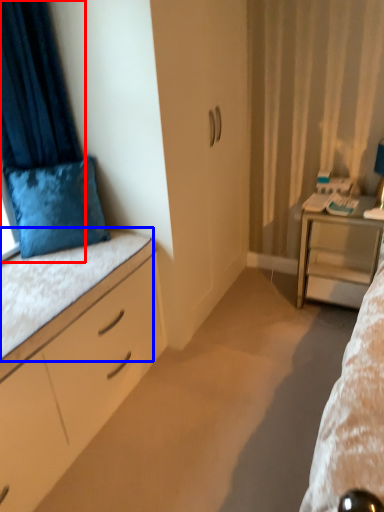
Question: Which of the following is the closest to the observer, curtain (highlighted by a red box) or ledge (highlighted by a blue box)?

Choices:
 (A) curtain
 (B) ledge

Answer: (B)